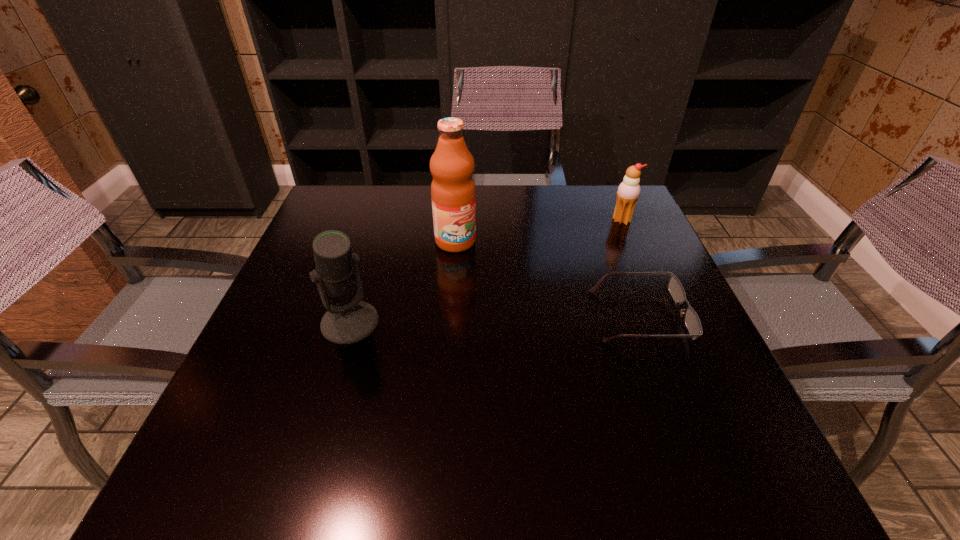
This screenshot has height=540, width=960. I want to click on free space between the spectacles and the second shortest object, so click(631, 268).

At what (x,y) coordinates should I click in order to perform the action: click on free spot between the fruit juice and the spectacles. Please return your answer as a coordinate pair (x, y). The width and height of the screenshot is (960, 540). Looking at the image, I should click on (547, 279).

This screenshot has width=960, height=540. Identify the location of empty location between the shortest object and the farthest object. (631, 268).

In order to click on vacant area between the third nearest object and the microphone in this screenshot , I will do `click(403, 282)`.

In order to click on vacant space that is in between the shortest object and the third nearest object in this screenshot , I will do `click(547, 279)`.

Where is `unoccupied position between the tallest object and the third shortest object`? Image resolution: width=960 pixels, height=540 pixels. unoccupied position between the tallest object and the third shortest object is located at coordinates (403, 282).

Choose which object is the second nearest neighbor to the leftmost object. Please provide its 2D coordinates. Your answer should be formatted as a tuple, i.e. [(x, y)], where the tuple contains the x and y coordinates of a point satisfying the conditions above.

[(692, 321)]

Find the location of `object that is the third closest one to the shortest object`. object that is the third closest one to the shortest object is located at coordinates (352, 320).

Locate an element on the screen. The width and height of the screenshot is (960, 540). vacant space that satisfies the following two spatial constraints: 1. on the front side of the tallest object; 2. on the front-facing side of the shortest object is located at coordinates (450, 316).

Identify the location of vacant position in the image that satisfies the following two spatial constraints: 1. on the front side of the third object from right to left; 2. on the front-facing side of the spectacles. (450, 316).